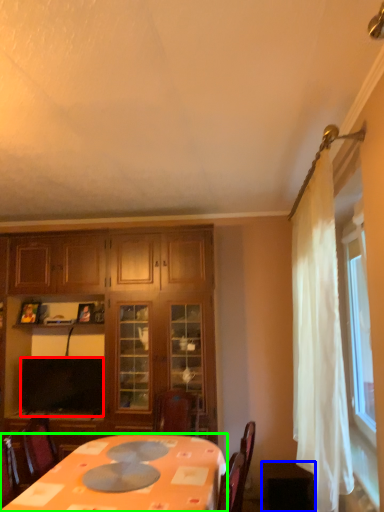
Question: Which is nearer to the television (highlighted by a red box)? table (highlighted by a blue box) or desk (highlighted by a green box).

Choices:
 (A) table
 (B) desk

Answer: (B)